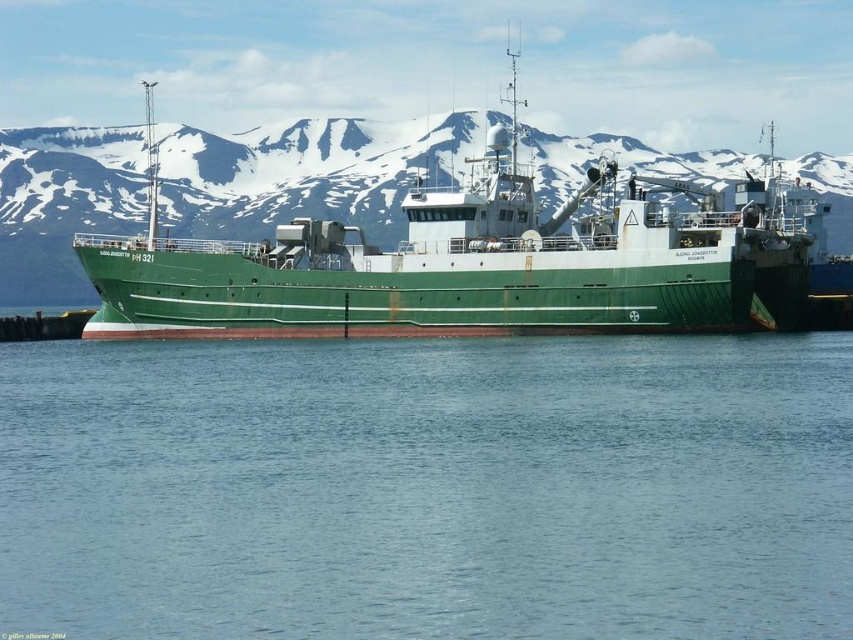
Between point (764, 378) and point (804, 230), which one is positioned behind?

Point (804, 230)

Locate an element on the screen. blue water at center is located at coordinates (428, 488).